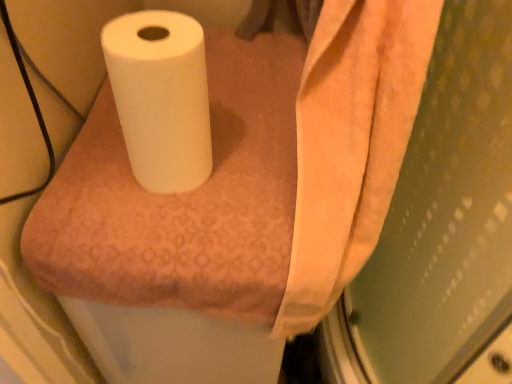
Identify the location of white matte paper towel at center. (250, 177).

The width and height of the screenshot is (512, 384). What do you see at coordinates (250, 177) in the screenshot?
I see `white matte paper towel at center` at bounding box center [250, 177].

Describe the element at coordinates (161, 97) in the screenshot. The width and height of the screenshot is (512, 384). I see `white matte toilet paper at center` at that location.

Locate an element on the screen. Image resolution: width=512 pixels, height=384 pixels. white matte toilet paper at center is located at coordinates (161, 97).

At what (x,y) coordinates should I click in order to perform the action: click on white matte paper towel at center. Please return your answer as a coordinate pair (x, y). The height and width of the screenshot is (384, 512). Looking at the image, I should click on (250, 177).

Does white matte paper towel at center appear on the left side of white matte toilet paper at center?

Incorrect, white matte paper towel at center is not on the left side of white matte toilet paper at center.

Is white matte paper towel at center closer to camera compared to white matte toilet paper at center?

No, white matte paper towel at center is behind white matte toilet paper at center.

Which point is more distant from viewer, (247, 97) or (141, 80)?

Point (247, 97)

From the image's perspective, which is below, white matte paper towel at center or white matte toilet paper at center?

white matte paper towel at center.

From a real-world perspective, is white matte paper towel at center on top of white matte toilet paper at center?

No, from a real-world perspective, white matte paper towel at center is not on top of white matte toilet paper at center.

Can you confirm if white matte paper towel at center is wider than white matte toilet paper at center?

Yes, white matte paper towel at center is wider than white matte toilet paper at center.

Considering the sizes of objects white matte paper towel at center and white matte toilet paper at center in the image provided, who is taller, white matte paper towel at center or white matte toilet paper at center?

white matte paper towel at center.

Between white matte paper towel at center and white matte toilet paper at center, which one has smaller size?

white matte toilet paper at center.

Is white matte paper towel at center spatially inside white matte toilet paper at center, or outside of it?

white matte paper towel at center is not enclosed by white matte toilet paper at center.

Is white matte paper towel at center beside white matte toilet paper at center?

white matte paper towel at center and white matte toilet paper at center are clearly separated.

From the picture: Is white matte paper towel at center facing towards white matte toilet paper at center?

No.

Measure the distance between white matte paper towel at center and white matte toilet paper at center.

white matte paper towel at center and white matte toilet paper at center are 6.60 inches apart from each other.

At what (x,y) coordinates should I click in order to perform the action: click on toilet paper in front of the white matte paper towel at center. Please return your answer as a coordinate pair (x, y). The width and height of the screenshot is (512, 384). Looking at the image, I should click on (161, 97).

Is white matte toilet paper at center to the left of white matte paper towel at center from the viewer's perspective?

Correct, you'll find white matte toilet paper at center to the left of white matte paper towel at center.

Which is in front, white matte toilet paper at center or white matte paper towel at center?

white matte toilet paper at center is closer to the camera.

Does point (150, 172) appear closer or farther from the camera than point (309, 218)?

Point (150, 172).

From the image's perspective, is white matte toilet paper at center located above or below white matte paper towel at center?

From the image's perspective, white matte toilet paper at center appears above white matte paper towel at center.

Looking at this image, from a real-world perspective, is white matte toilet paper at center on white matte paper towel at center?

Correct, in the physical world, white matte toilet paper at center is higher than white matte paper towel at center.

Is white matte toilet paper at center wider than white matte paper towel at center?

No.

Based on the photo, is white matte toilet paper at center shorter than white matte paper towel at center?

Indeed, white matte toilet paper at center has a lesser height compared to white matte paper towel at center.

Is white matte toilet paper at center bigger than white matte paper towel at center?

Actually, white matte toilet paper at center might be smaller than white matte paper towel at center.

Is white matte toilet paper at center inside the boundaries of white matte paper towel at center, or outside?

The correct answer is: outside.

Is white matte toilet paper at center touching white matte paper towel at center?

No, white matte toilet paper at center is not touching white matte paper towel at center.

Is white matte toilet paper at center aimed at white matte paper towel at center?

No, white matte toilet paper at center is not facing towards white matte paper towel at center.

You are a GUI agent. You are given a task and a screenshot of the screen. Output one action in this format:
    pyautogui.click(x=<x>, y=<y>)
    Task: Click on the paper towel located below the white matte toilet paper at center (from the image's perspective)
    This screenshot has width=512, height=384.
    Given the screenshot: What is the action you would take?
    pyautogui.click(x=250, y=177)

I want to click on toilet paper that is on the left side of white matte paper towel at center, so click(x=161, y=97).

There is a white matte paper towel at center. Identify the location of toilet paper above it (from a real-world perspective). The height and width of the screenshot is (384, 512). (161, 97).